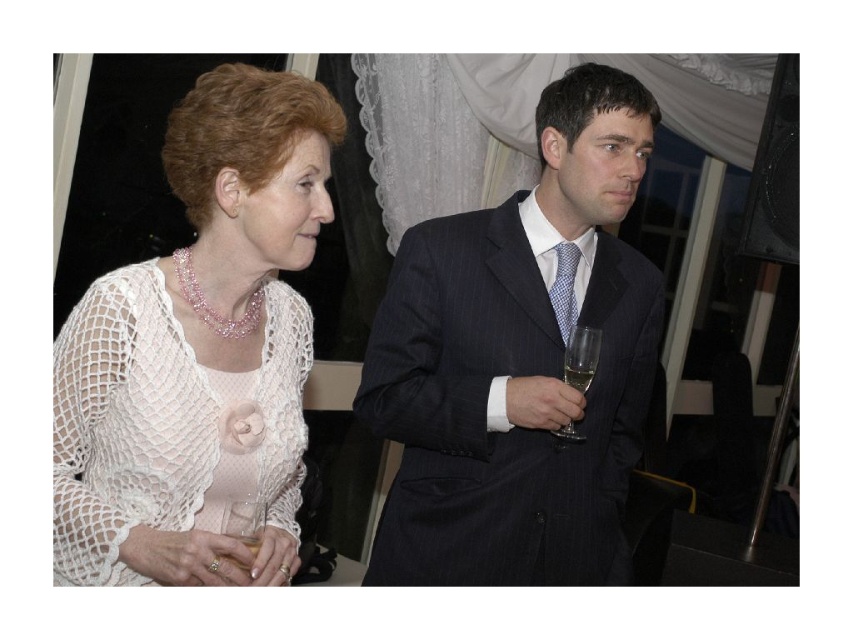
Question: Which object is the closest to the clear glass wine glass at lower left?

Choices:
 (A) clear glass wine glass at right
 (B) dark blue pinstripe suit at center
 (C) white crochet sweater at left

Answer: (C)

Question: Is white crochet sweater at left to the left of clear glass wine glass at right from the viewer's perspective?

Choices:
 (A) yes
 (B) no

Answer: (A)

Question: Among these objects, which one is farthest from the camera?

Choices:
 (A) dark blue pinstripe suit at center
 (B) matte glass at right
 (C) clear glass wine glass at right
 (D) clear glass wine glass at lower left

Answer: (A)

Question: Can you confirm if white crochet sweater at left is positioned to the right of matte glass at right?

Choices:
 (A) no
 (B) yes

Answer: (A)

Question: Which point is closer to the camera?

Choices:
 (A) clear glass wine glass at right
 (B) white crochet sweater at left
 (C) dark blue pinstripe suit at center

Answer: (B)

Question: Can you confirm if white crochet sweater at left is smaller than matte glass at right?

Choices:
 (A) yes
 (B) no

Answer: (B)